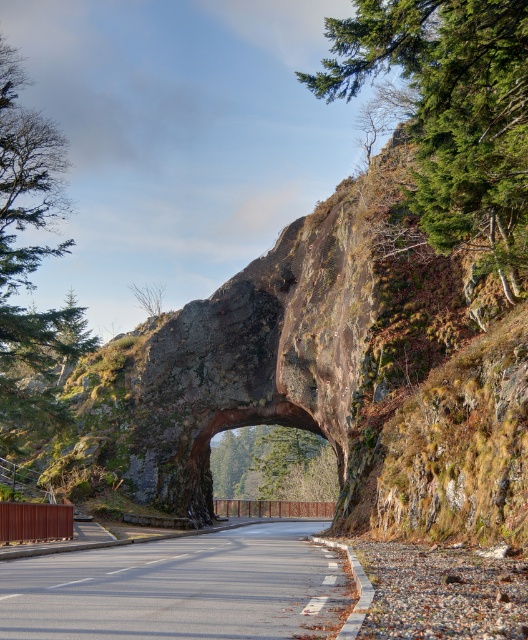
You are driving a truck that is 10 meters long. You see the asphalt road at center and the green leafy tree at center in front of you. Can your truck pass through the space between them without hitting either?

The asphalt road at center is smaller than the green leafy tree at center. Since the truck is 10 meters long, it cannot pass through the space between them without hitting either object because the available space is narrower than the truck.

You are a hiker standing at the entrance of the rock arch tunnel. You see the green textured tree at upper left and the green leafy tree at center. Which tree is positioned more to the left side of the scene?

The green textured tree at upper left is positioned more to the left side of the scene compared to the green leafy tree at center.